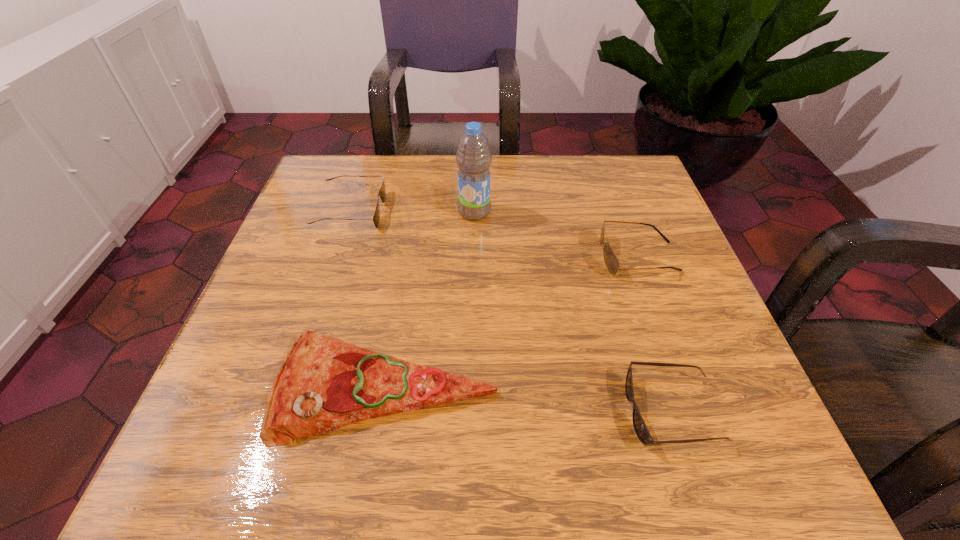
The width and height of the screenshot is (960, 540). Find the location of `the tallest object`. the tallest object is located at coordinates (473, 157).

Image resolution: width=960 pixels, height=540 pixels. What are the coordinates of `the third nearest object` in the screenshot? It's located at (612, 264).

Find the location of a particular element. The width and height of the screenshot is (960, 540). the second nearest sunglasses is located at coordinates (612, 264).

Locate an element on the screen. the second shortest sunglasses is located at coordinates (382, 192).

Identify the location of the farthest sunglasses. The height and width of the screenshot is (540, 960). (382, 192).

Locate an element on the screen. Image resolution: width=960 pixels, height=540 pixels. pizza is located at coordinates (324, 383).

Find the location of a particular element. the nearest sunglasses is located at coordinates (640, 427).

Where is `vacant space situated on the left of the tallest object`? This screenshot has height=540, width=960. vacant space situated on the left of the tallest object is located at coordinates (410, 212).

This screenshot has width=960, height=540. I want to click on vacant region located 0.190m on the front-facing side of the tallest sunglasses, so click(x=507, y=256).

Locate an element on the screen. The height and width of the screenshot is (540, 960). free location located on the front-facing side of the tallest sunglasses is located at coordinates (468, 256).